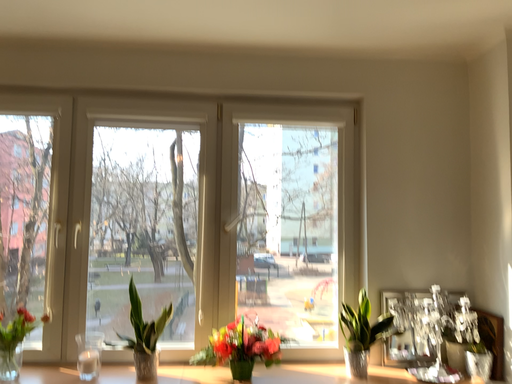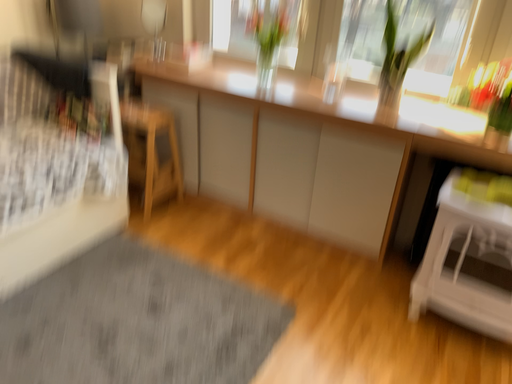
Question: Which way did the camera rotate in the video?

Choices:
 (A) rotated downward
 (B) rotated upward

Answer: (A)